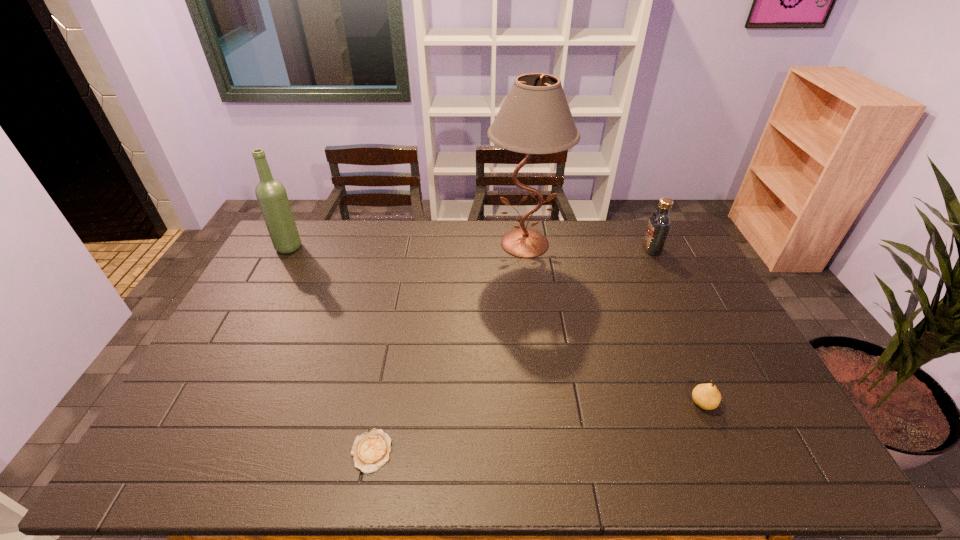
What are the coordinates of `object present at the left edge` in the screenshot? It's located at (271, 194).

The height and width of the screenshot is (540, 960). I want to click on vodka that is at the right edge, so click(659, 224).

Where is `pear situated at the right edge`? The height and width of the screenshot is (540, 960). pear situated at the right edge is located at coordinates (706, 396).

Locate an element on the screen. object positioned at the far left corner is located at coordinates 271,194.

Locate an element on the screen. object located in the far right corner section of the desktop is located at coordinates (659, 224).

In the image, there is a desktop. Where is `vacant space at the far edge`? vacant space at the far edge is located at coordinates (462, 223).

At what (x,y) coordinates should I click in order to perform the action: click on vacant space at the left edge. Please return your answer as a coordinate pair (x, y). Image resolution: width=960 pixels, height=540 pixels. Looking at the image, I should click on 261,268.

Identify the location of free spot at the right edge of the desktop. This screenshot has width=960, height=540. tap(680, 267).

I want to click on vacant space in between the table lamp and the leftmost object, so click(407, 245).

In order to click on vacant area that lies between the second nearest object and the second tallest object in this screenshot , I will do `click(496, 325)`.